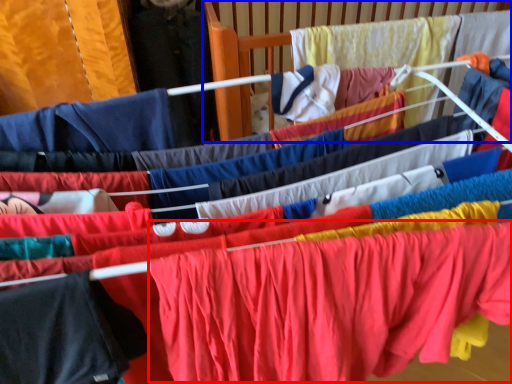
Question: Which object appears closest to the camera in this image, clothing (highlighted by a red box) or infant bed (highlighted by a blue box)?

Choices:
 (A) clothing
 (B) infant bed

Answer: (A)